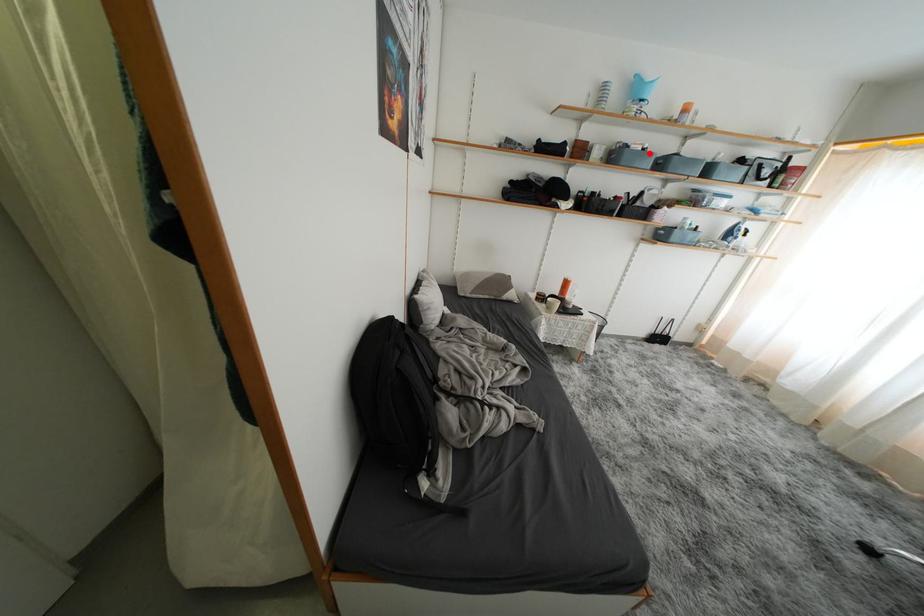
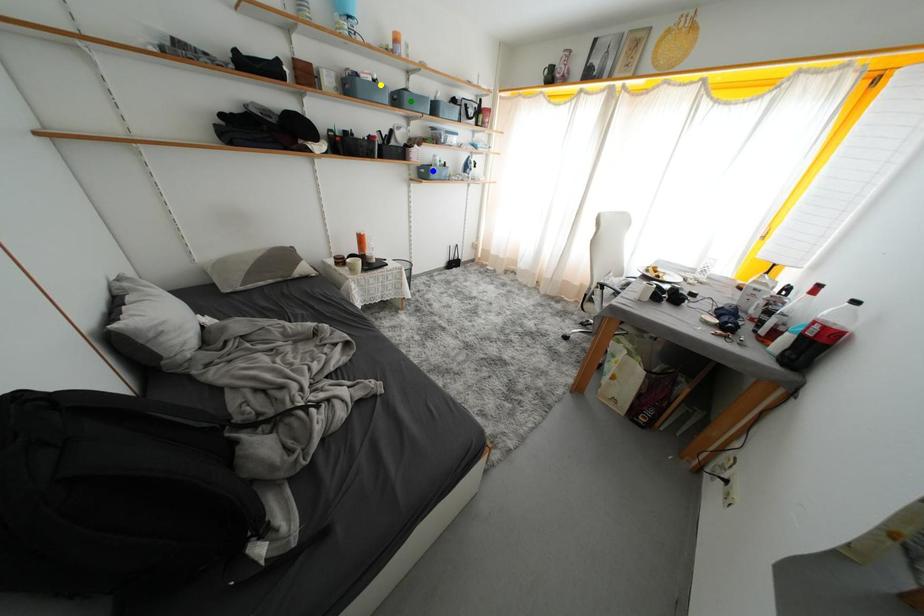
Question: I am providing you with two images of the same scene from different viewpoints. A red point is marked on the first image. You are given multiple points on the second image. Which mark in image 2 goes with the point in image 1?

Choices:
 (A) green point
 (B) yellow point
 (C) blue point

Answer: (B)